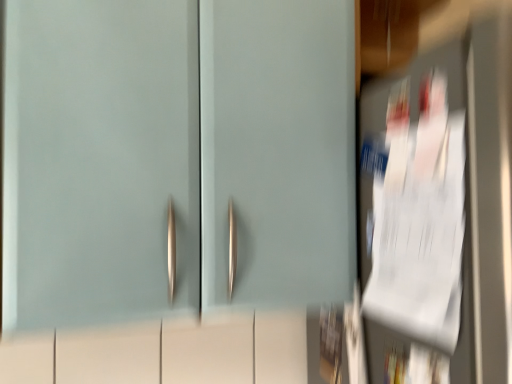
Question: From the image's perspective, is white paper at right, which is the 2th door in left-to-right order, above matte teal cabinet at center, marked as the 2th door in a right-to-left arrangement?

Choices:
 (A) no
 (B) yes

Answer: (A)

Question: Can you confirm if white paper at right, placed as the first door when sorted from right to left, is positioned to the left of matte teal cabinet at center, marked as the 2th door in a right-to-left arrangement?

Choices:
 (A) no
 (B) yes

Answer: (A)

Question: Does white paper at right, placed as the first door when sorted from right to left, have a greater width compared to matte teal cabinet at center, which ranks as the 1th door in left-to-right order?

Choices:
 (A) no
 (B) yes

Answer: (B)

Question: Is white paper at right, placed as the first door when sorted from right to left, positioned with its back to matte teal cabinet at center, which ranks as the 1th door in left-to-right order?

Choices:
 (A) no
 (B) yes

Answer: (A)

Question: From a real-world perspective, does white paper at right, placed as the first door when sorted from right to left, sit lower than matte teal cabinet at center, which ranks as the 1th door in left-to-right order?

Choices:
 (A) no
 (B) yes

Answer: (B)

Question: From a real-world perspective, is white paper at right, placed as the first door when sorted from right to left, on top of matte teal cabinet at center, marked as the 2th door in a right-to-left arrangement?

Choices:
 (A) yes
 (B) no

Answer: (B)

Question: Is matte teal cabinet at center, which ranks as the 1th door in left-to-right order, completely or partially outside of white paper at right, placed as the first door when sorted from right to left?

Choices:
 (A) no
 (B) yes

Answer: (B)

Question: Can you confirm if matte teal cabinet at center, marked as the 2th door in a right-to-left arrangement, is positioned to the right of white paper at right, which is the 2th door in left-to-right order?

Choices:
 (A) yes
 (B) no

Answer: (B)

Question: Is white paper at right, which is the 2th door in left-to-right order, located within matte teal cabinet at center, which ranks as the 1th door in left-to-right order?

Choices:
 (A) no
 (B) yes

Answer: (A)

Question: Considering the relative sizes of matte teal cabinet at center, marked as the 2th door in a right-to-left arrangement, and white paper at right, which is the 2th door in left-to-right order, in the image provided, is matte teal cabinet at center, marked as the 2th door in a right-to-left arrangement, wider than white paper at right, which is the 2th door in left-to-right order,?

Choices:
 (A) yes
 (B) no

Answer: (B)

Question: Does matte teal cabinet at center, marked as the 2th door in a right-to-left arrangement, have a greater height compared to white paper at right, placed as the first door when sorted from right to left?

Choices:
 (A) yes
 (B) no

Answer: (B)

Question: Is matte teal cabinet at center, marked as the 2th door in a right-to-left arrangement, behind white paper at right, which is the 2th door in left-to-right order?

Choices:
 (A) yes
 (B) no

Answer: (A)

Question: Relative to matte teal cabinet at center, which ranks as the 1th door in left-to-right order, is white paper at right, placed as the first door when sorted from right to left, in front or behind?

Choices:
 (A) front
 (B) behind

Answer: (A)